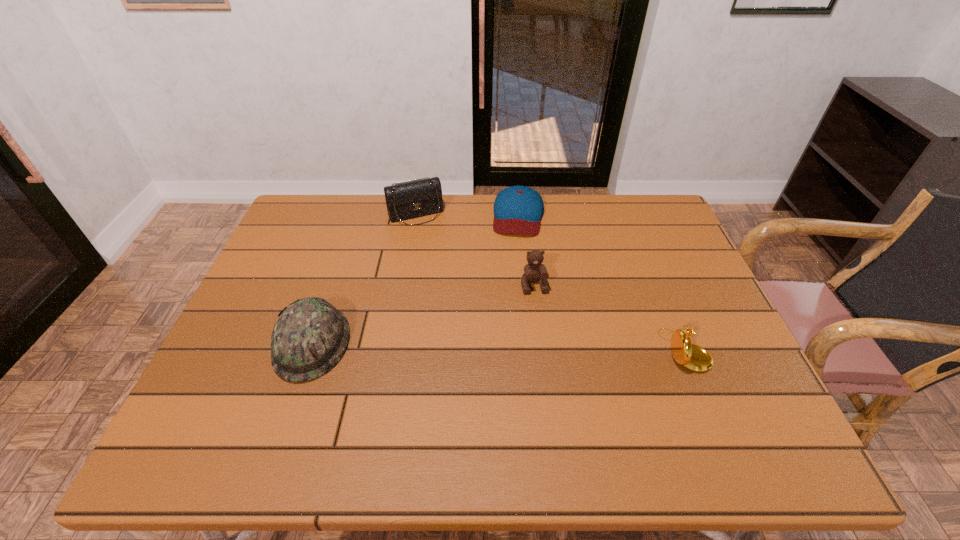
Find the location of a particular element. The image size is (960, 540). free space on the desktop that is between the headwear and the rightmost object and is positioned on the face of the teddy bear is located at coordinates (547, 348).

Where is `free spot on the desktop that is between the headwear and the pocket watch and is positioned with the bill of the baseball cap facing forward`? This screenshot has width=960, height=540. free spot on the desktop that is between the headwear and the pocket watch and is positioned with the bill of the baseball cap facing forward is located at coordinates (503, 347).

Locate an element on the screen. free space on the desktop that is between the leftmost object and the pocket watch and is positioned on the front flap of the clutch bag is located at coordinates (476, 347).